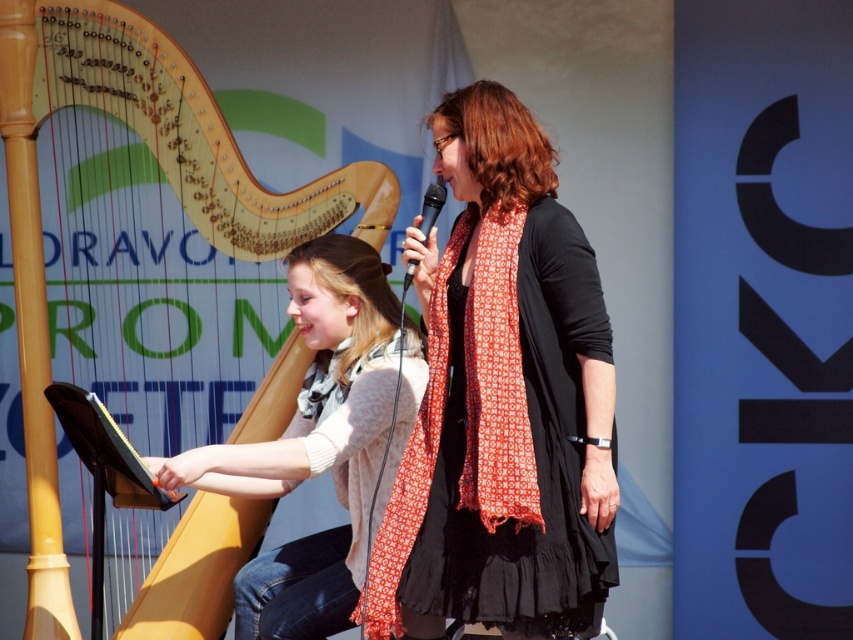
Is matte black dress at center positioned before light beige sweater at center?

Yes.

Which is below, matte black dress at center or light beige sweater at center?

Positioned lower is light beige sweater at center.

Between point (509, 547) and point (267, 454), which one is positioned behind?

The point (267, 454) is behind.

Identify the location of matte black dress at center. (502, 401).

Which of these two, matte black dress at center or wooden harp at left, stands taller?

wooden harp at left

Can you confirm if matte black dress at center is wider than wooden harp at left?

Incorrect, matte black dress at center's width does not surpass wooden harp at left's.

Locate an element on the screen. matte black dress at center is located at coordinates (502, 401).

You are a GUI agent. You are given a task and a screenshot of the screen. Output one action in this format:
    pyautogui.click(x=<x>, y=<y>)
    Task: Click on the matte black dress at center
    Image resolution: width=853 pixels, height=640 pixels.
    Given the screenshot: What is the action you would take?
    pyautogui.click(x=502, y=401)

Which is more to the left, wooden harp at left or orange printed scarf at center?

wooden harp at left

Between wooden harp at left and orange printed scarf at center, which one is positioned lower?

orange printed scarf at center

Is point (114, 513) less distant than point (482, 362)?

No, (114, 513) is behind (482, 362).

Identify the location of wooden harp at left. pos(160,243).